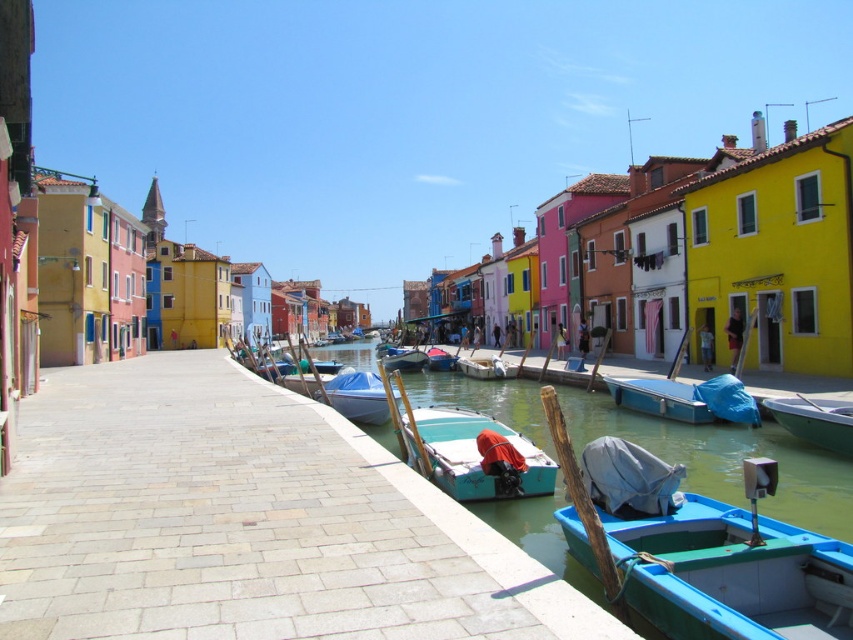
Is blue plastic boat at lower right closer to camera compared to smooth white boat at center?

Yes, blue plastic boat at lower right is in front of smooth white boat at center.

Is point (654, 560) behind point (381, 349)?

No, (654, 560) is closer to viewer.

Where is `blue plastic boat at lower right`? The image size is (853, 640). blue plastic boat at lower right is located at coordinates (704, 556).

Based on the photo, does blue plastic boat at lower right have a greater width compared to green matte boat at lower right?

Indeed, blue plastic boat at lower right has a greater width compared to green matte boat at lower right.

Image resolution: width=853 pixels, height=640 pixels. What do you see at coordinates (704, 556) in the screenshot?
I see `blue plastic boat at lower right` at bounding box center [704, 556].

Measure the distance between point (x=608, y=458) and camera.

Point (x=608, y=458) is 8.76 meters from camera.

Where is `blue plastic boat at lower right`? blue plastic boat at lower right is located at coordinates click(x=704, y=556).

Which is more to the left, blue plastic boat at lower right or teal matte boat at center?

Positioned to the left is teal matte boat at center.

Identify the location of blue plastic boat at lower right. The width and height of the screenshot is (853, 640). (704, 556).